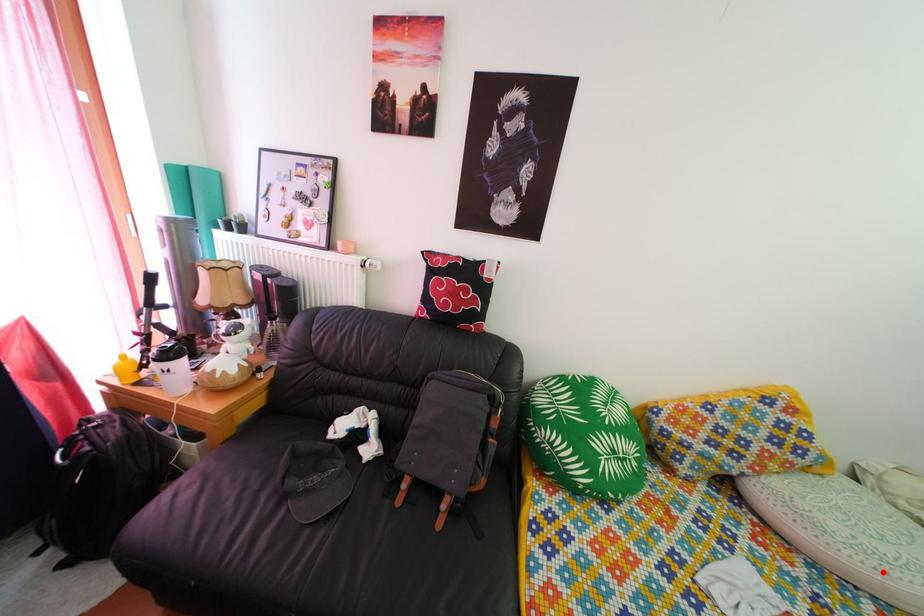
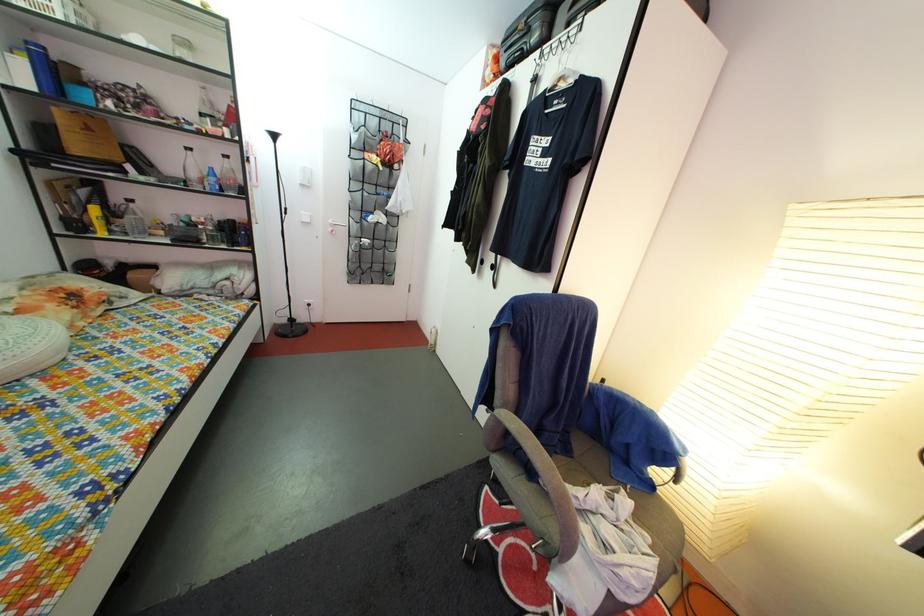
Question: I am providing you with two images of the same scene from different viewpoints. A red point is shown in image1. For the corresponding object point in image2, is it positioned nearer or farther from the camera?

Choices:
 (A) Nearer
 (B) Farther

Answer: (B)